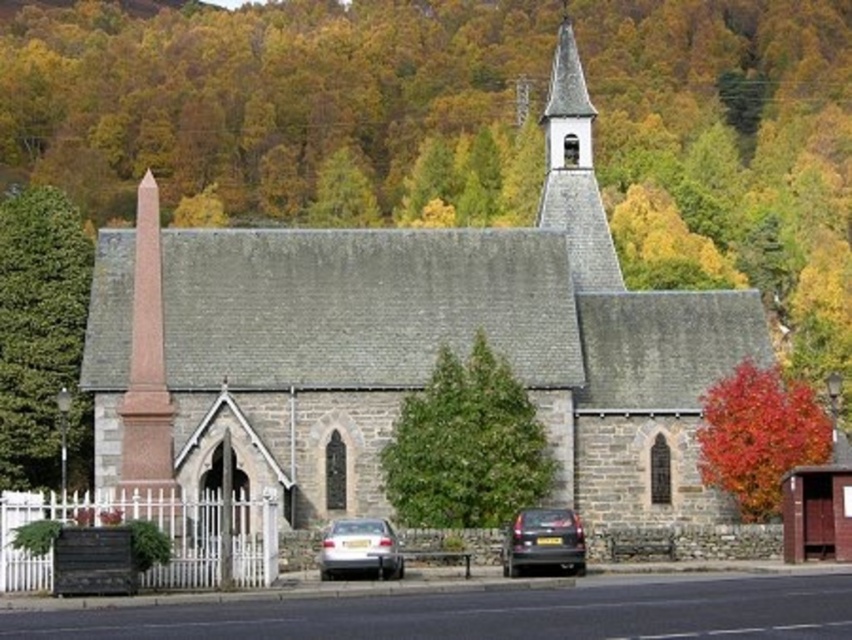
In the scene shown: Which is above, green leafy tree at center or pink polished stone obelisk at left?

pink polished stone obelisk at left

The height and width of the screenshot is (640, 852). Describe the element at coordinates (465, 445) in the screenshot. I see `green leafy tree at center` at that location.

Is point (396, 496) closer to camera compared to point (128, 404)?

No, it is not.

Identify the location of green leafy tree at center. (465, 445).

Is green leafy tree at left taller than shiny black car at center?

Correct, green leafy tree at left is much taller as shiny black car at center.

Between green leafy tree at left and shiny black car at center, which one has less height?

shiny black car at center is shorter.

Is point (24, 467) less distant than point (551, 524)?

That is False.

Where is `green leafy tree at left`? green leafy tree at left is located at coordinates (41, 333).

Which is below, green leafy tree at left or smooth gray steeple at upper center?

green leafy tree at left

Is green leafy tree at left wider than smooth gray steeple at upper center?

Indeed, green leafy tree at left has a greater width compared to smooth gray steeple at upper center.

Does point (58, 278) come behind point (562, 209)?

No, it is in front of (562, 209).

Where is `green leafy tree at left`? Image resolution: width=852 pixels, height=640 pixels. green leafy tree at left is located at coordinates (41, 333).